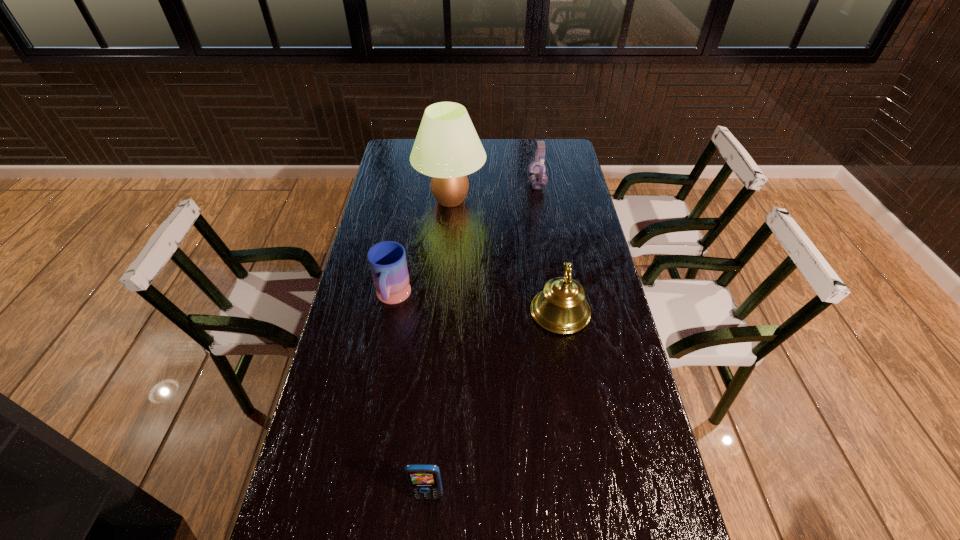
Where is `the tallest object`? This screenshot has height=540, width=960. the tallest object is located at coordinates point(447,148).

Image resolution: width=960 pixels, height=540 pixels. What are the coordinates of `bell` in the screenshot? It's located at (561, 308).

Where is `headset`? The image size is (960, 540). headset is located at coordinates (538, 179).

This screenshot has width=960, height=540. Identify the location of mug. (387, 260).

The image size is (960, 540). I want to click on cellular telephone, so click(424, 480).

The width and height of the screenshot is (960, 540). Find the location of `blank area located on the shade of the tallest object`. blank area located on the shade of the tallest object is located at coordinates (508, 200).

Find the location of `vacant region located on the left of the bell`. vacant region located on the left of the bell is located at coordinates (473, 312).

I want to click on vacant space located 0.120m on the headband and ear cups of the headset, so tap(500, 183).

The width and height of the screenshot is (960, 540). I want to click on free space located 0.170m on the headband and ear cups of the headset, so click(x=488, y=183).

You are a GUI agent. You are given a task and a screenshot of the screen. Output one action in this format:
    pyautogui.click(x=<x>, y=<y>)
    Task: Click on the vacant space located on the headband and ear cups of the headset
    
    Given the screenshot: What is the action you would take?
    click(x=492, y=183)